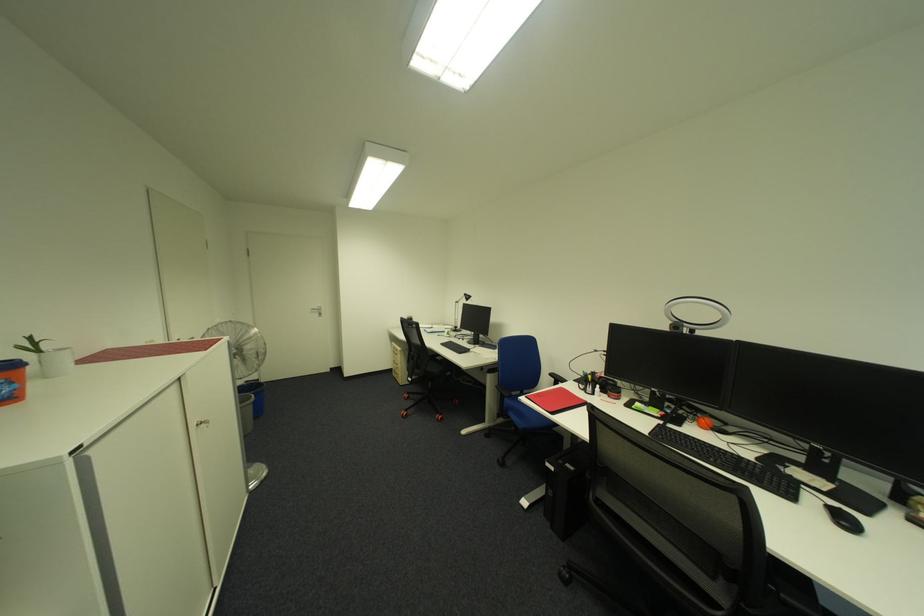
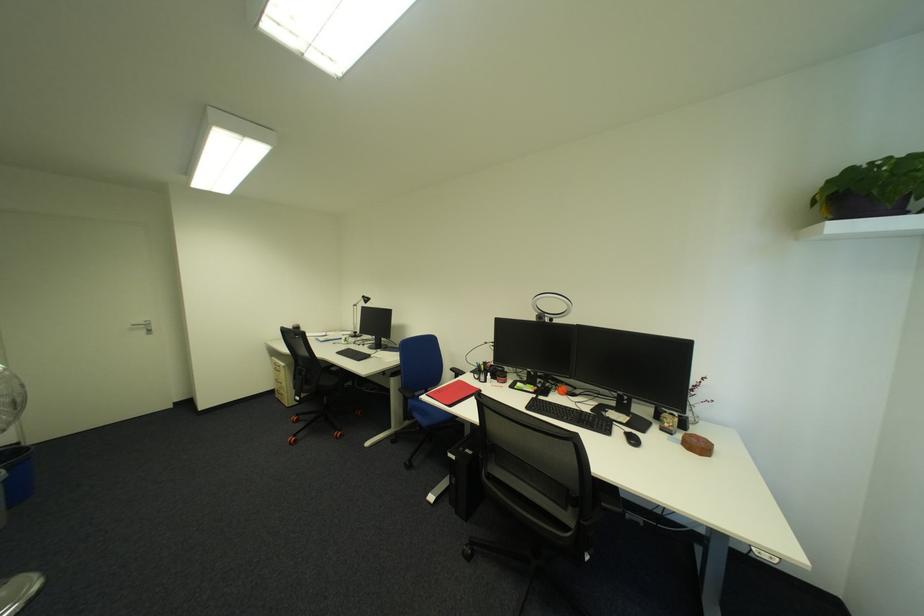
In the second image, find the point that corresponds to the point at 675,328 in the first image.

(542, 318)